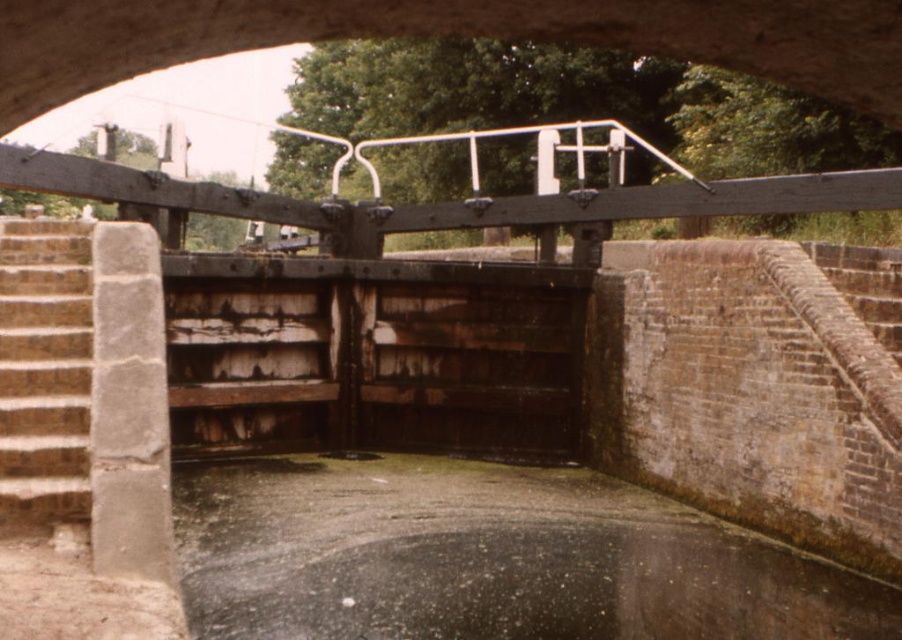
Question: Which point is closer to the camera?

Choices:
 (A) brown stone stairs at left
 (B) glossy concrete puddle at center

Answer: (A)

Question: Does brown stone stairs at left appear under glossy concrete puddle at center?

Choices:
 (A) yes
 (B) no

Answer: (B)

Question: Observing the image, what is the correct spatial positioning of brown stone stairs at left in reference to glossy concrete puddle at center?

Choices:
 (A) above
 (B) below

Answer: (A)

Question: Can you confirm if brown stone stairs at left is smaller than glossy concrete puddle at center?

Choices:
 (A) yes
 (B) no

Answer: (B)